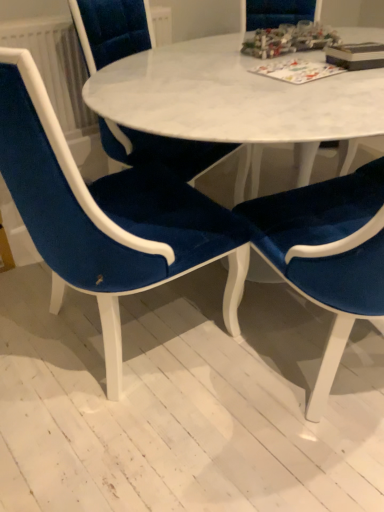
Question: Is matte paper board game at upper center, acting as the first book starting from the left, looking in the opposite direction of velvet blue chair at center, the 2th chair viewed from the right?

Choices:
 (A) no
 (B) yes

Answer: (A)

Question: Is matte paper board game at upper center, the 2th book from the right, bigger than velvet blue chair at center, which is the second chair from left to right?

Choices:
 (A) yes
 (B) no

Answer: (B)

Question: Considering the relative sizes of matte paper board game at upper center, acting as the first book starting from the left, and velvet blue chair at center, the 2th chair viewed from the right, in the image provided, is matte paper board game at upper center, acting as the first book starting from the left, wider than velvet blue chair at center, the 2th chair viewed from the right,?

Choices:
 (A) no
 (B) yes

Answer: (A)

Question: Considering the relative sizes of matte paper board game at upper center, the 2th book from the right, and velvet blue chair at center, the 2th chair viewed from the right, in the image provided, is matte paper board game at upper center, the 2th book from the right, shorter than velvet blue chair at center, the 2th chair viewed from the right,?

Choices:
 (A) no
 (B) yes

Answer: (B)

Question: From the image's perspective, is matte paper board game at upper center, the 2th book from the right, above velvet blue chair at center, which is the second chair from left to right?

Choices:
 (A) yes
 (B) no

Answer: (A)

Question: Considering the positions of velvet blue chair at center, the 2th chair viewed from the right, and matte paper board game at upper center, acting as the first book starting from the left, in the image, is velvet blue chair at center, the 2th chair viewed from the right, taller or shorter than matte paper board game at upper center, acting as the first book starting from the left,?

Choices:
 (A) short
 (B) tall

Answer: (B)

Question: From the image's perspective, is velvet blue chair at center, which is the second chair from left to right, located above or below matte paper board game at upper center, the 2th book from the right?

Choices:
 (A) below
 (B) above

Answer: (A)

Question: Relative to matte paper board game at upper center, acting as the first book starting from the left, is velvet blue chair at center, the 2th chair viewed from the right, in front or behind?

Choices:
 (A) behind
 (B) front

Answer: (B)

Question: From a real-world perspective, is velvet blue chair at center, which is the second chair from left to right, above or below matte paper board game at upper center, the 2th book from the right?

Choices:
 (A) above
 (B) below

Answer: (B)

Question: Do you think matte paper board game at upper center, the 2th book from the right, is within white textured radiator at upper left, or outside of it?

Choices:
 (A) outside
 (B) inside

Answer: (A)

Question: From the image's perspective, is matte paper board game at upper center, acting as the first book starting from the left, located above or below white textured radiator at upper left?

Choices:
 (A) above
 (B) below

Answer: (B)

Question: From a real-world perspective, relative to white textured radiator at upper left, is matte paper board game at upper center, acting as the first book starting from the left, vertically above or below?

Choices:
 (A) above
 (B) below

Answer: (A)

Question: Considering the positions of point (329, 64) and point (39, 69), is point (329, 64) closer or farther from the camera than point (39, 69)?

Choices:
 (A) closer
 (B) farther

Answer: (A)

Question: In the image, is white textured radiator at upper left positioned in front of or behind velvet blue chair at center, the 2th chair viewed from the right?

Choices:
 (A) behind
 (B) front

Answer: (A)

Question: From a real-world perspective, is white textured radiator at upper left positioned above or below velvet blue chair at center, which is the second chair from left to right?

Choices:
 (A) above
 (B) below

Answer: (A)